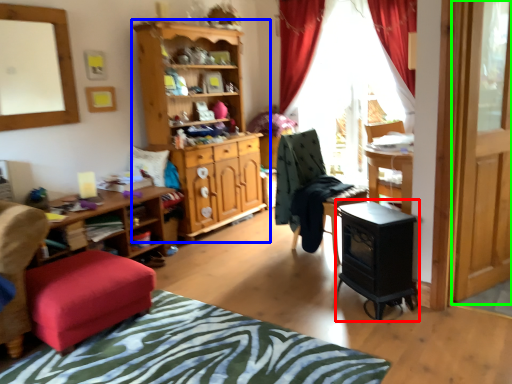
Question: Which is farther away from computer desk (highlighted by a red box)? cabinetry (highlighted by a blue box) or screen door (highlighted by a green box)?

Choices:
 (A) cabinetry
 (B) screen door

Answer: (A)